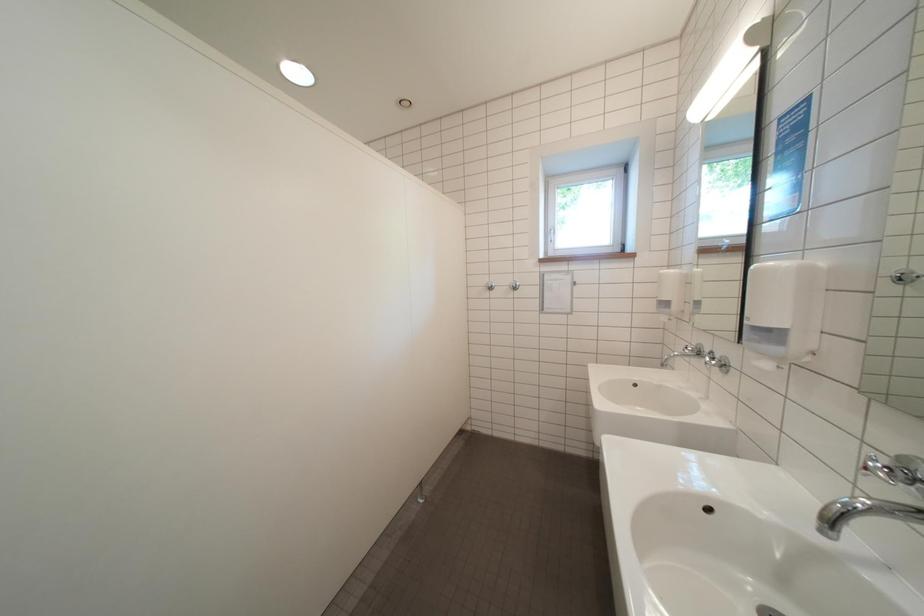
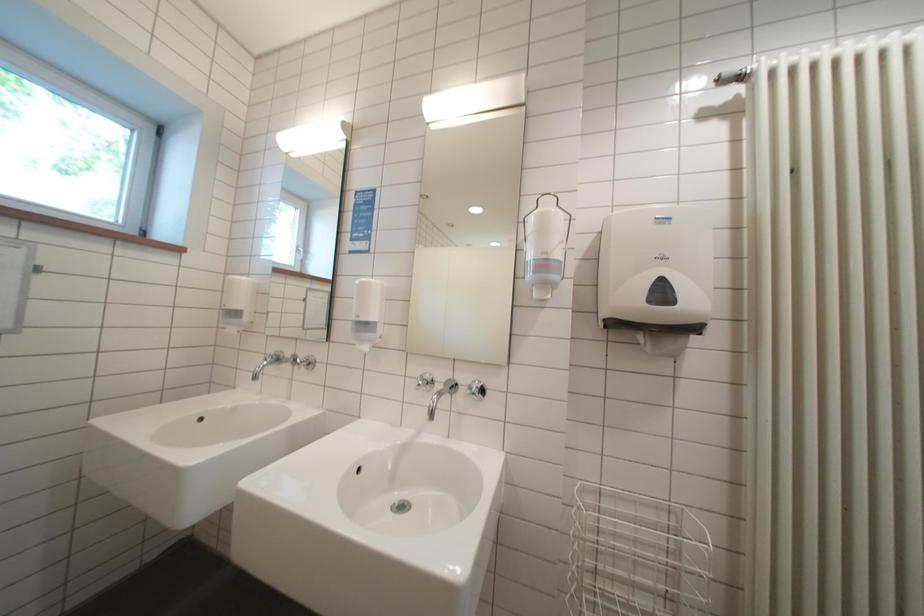
Question: Based on the continuous images, in which direction is the camera rotating? Reply with the corresponding letter.

Choices:
 (A) Left
 (B) Right
 (C) Up
 (D) Down

Answer: (B)